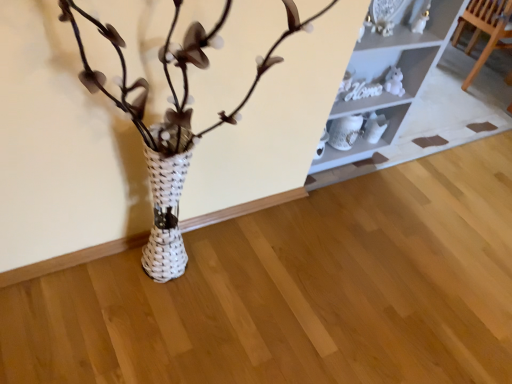
Question: From a real-world perspective, is white glossy shelf at upper center on top of wooden chair at upper right?

Choices:
 (A) yes
 (B) no

Answer: (A)

Question: Would you consider white glossy shelf at upper center to be distant from wooden chair at upper right?

Choices:
 (A) yes
 (B) no

Answer: (A)

Question: Is white glossy shelf at upper center not within wooden chair at upper right?

Choices:
 (A) yes
 (B) no

Answer: (A)

Question: Is white glossy shelf at upper center looking in the opposite direction of wooden chair at upper right?

Choices:
 (A) yes
 (B) no

Answer: (B)

Question: Is white glossy shelf at upper center beside wooden chair at upper right?

Choices:
 (A) yes
 (B) no

Answer: (B)

Question: Considering the relative positions of white glossy shelf at upper center and wooden chair at upper right in the image provided, is white glossy shelf at upper center in front of wooden chair at upper right?

Choices:
 (A) no
 (B) yes

Answer: (B)

Question: Considering the relative sizes of wooden chair at upper right and white glossy shelf at upper center in the image provided, is wooden chair at upper right taller than white glossy shelf at upper center?

Choices:
 (A) yes
 (B) no

Answer: (B)

Question: Is wooden chair at upper right to the left of white glossy shelf at upper center from the viewer's perspective?

Choices:
 (A) yes
 (B) no

Answer: (B)

Question: Is wooden chair at upper right facing away from white glossy shelf at upper center?

Choices:
 (A) yes
 (B) no

Answer: (A)

Question: Is wooden chair at upper right not inside white glossy shelf at upper center?

Choices:
 (A) yes
 (B) no

Answer: (A)

Question: Is wooden chair at upper right further to camera compared to white glossy shelf at upper center?

Choices:
 (A) yes
 (B) no

Answer: (A)

Question: From a real-world perspective, does wooden chair at upper right stand above white glossy shelf at upper center?

Choices:
 (A) no
 (B) yes

Answer: (A)

Question: In terms of height, does white glossy shelf at upper center look taller or shorter compared to wooden chair at upper right?

Choices:
 (A) short
 (B) tall

Answer: (B)